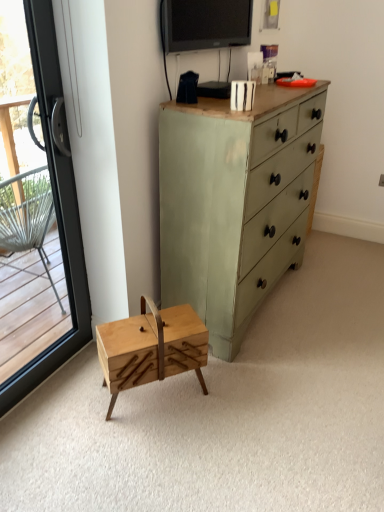
Image resolution: width=384 pixels, height=512 pixels. What are the coordinates of `vacant region to the left of natural wood sewing box at center` in the screenshot? It's located at (77, 402).